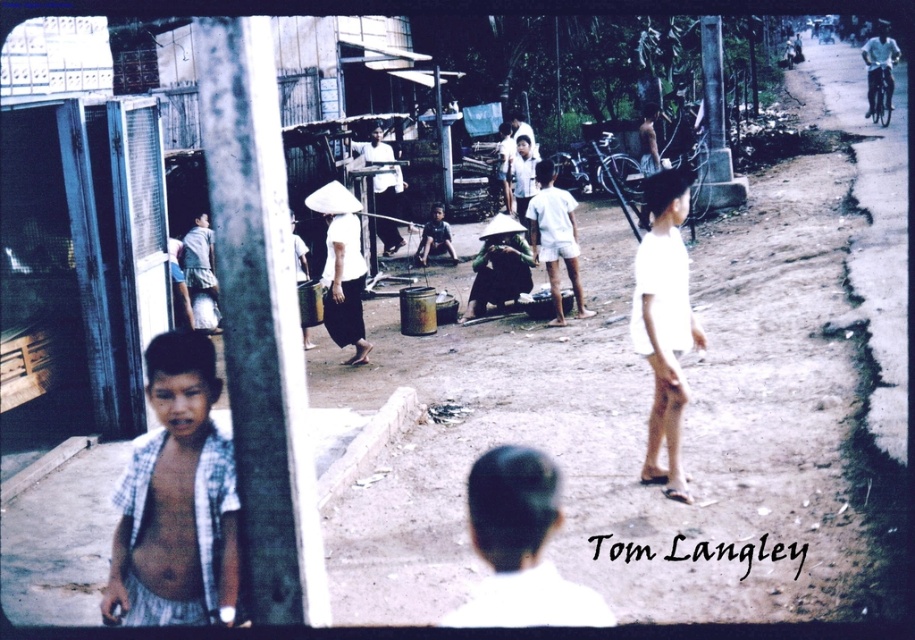
Based on the scene description, where is the white matte shorts at right located in terms of coordinates?

The white matte shorts at right are located at coordinates point [663,321].

You are a photographer trying to capture a clear shot of both the matte black hat at center and the matte white shirt at center. Based on their heights, which object should you focus on first to ensure both are in frame?

The matte black hat at center is much taller than the matte white shirt at center, so you should focus on the matte black hat at center first to ensure both are in frame.